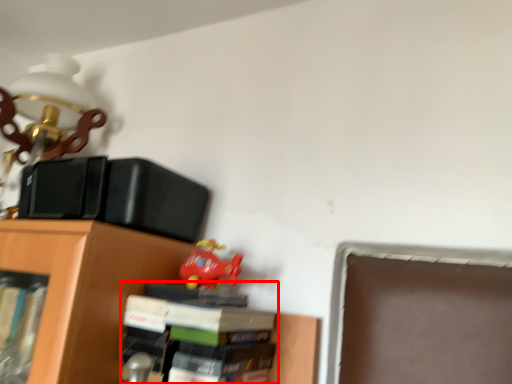
Question: Considering the relative positions of book (annotated by the red box) and toy in the image provided, where is book (annotated by the red box) located with respect to the staircase?

Choices:
 (A) left
 (B) right

Answer: (B)